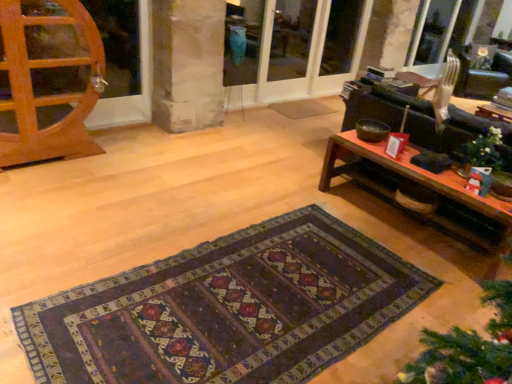
Question: Based on their sizes in the image, would you say white matte christmas ornament at right is bigger or smaller than transparent glass screen door at upper center, the 3th screen door positioned from the left?

Choices:
 (A) big
 (B) small

Answer: (B)

Question: Is white matte christmas ornament at right taller or shorter than transparent glass screen door at upper center, the 3th screen door positioned from the left?

Choices:
 (A) tall
 (B) short

Answer: (B)

Question: Considering the real-world distances, which object is closest to the white matte christmas ornament at right?

Choices:
 (A) wooden coffee table at right
 (B) dark woven rug at center
 (C) transparent glass screen door at upper center, acting as the first screen door starting from the left
 (D) metallic silver armchair at upper right
 (E) matte glass screen door at center, the second screen door in the left-to-right sequence

Answer: (A)

Question: Based on their relative distances, which object is farther from the transparent glass screen door at upper center, acting as the first screen door starting from the left?

Choices:
 (A) dark woven rug at center
 (B) transparent glass screen door at upper center, marked as the first screen door in a right-to-left arrangement
 (C) wooden coffee table at right
 (D) matte glass screen door at center, the second screen door in the left-to-right sequence
 (E) white matte christmas ornament at right

Answer: (A)